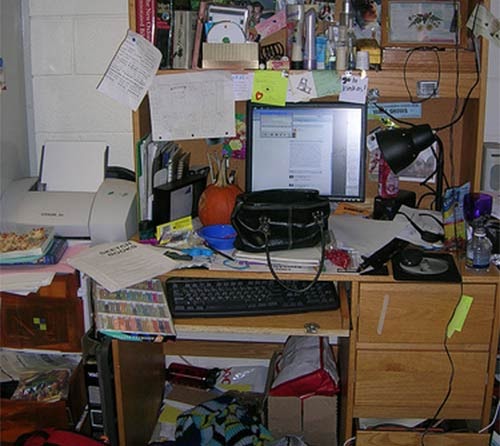
Locate an element on the screen. This screenshot has height=446, width=500. books is located at coordinates [x=142, y=15], [x=159, y=23], [x=174, y=25].